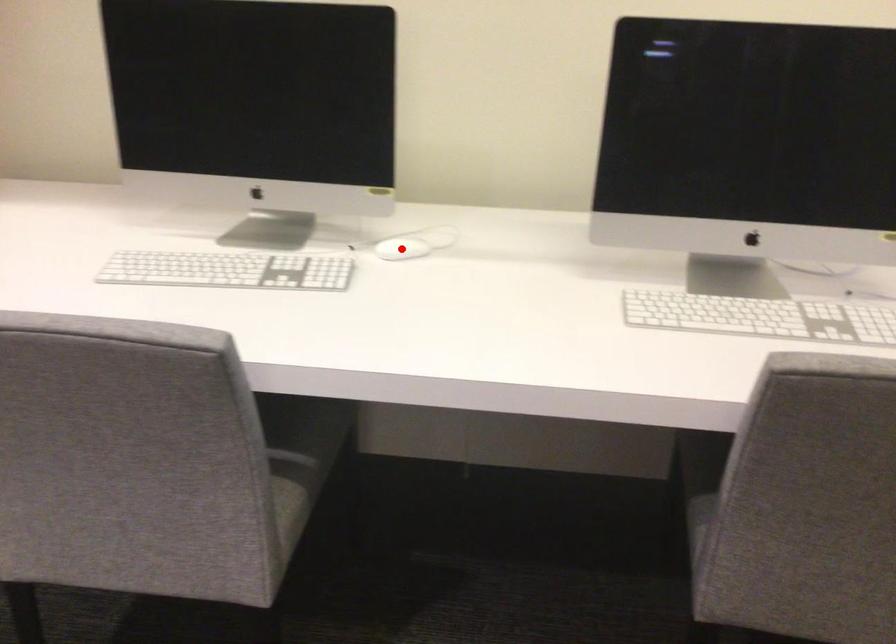
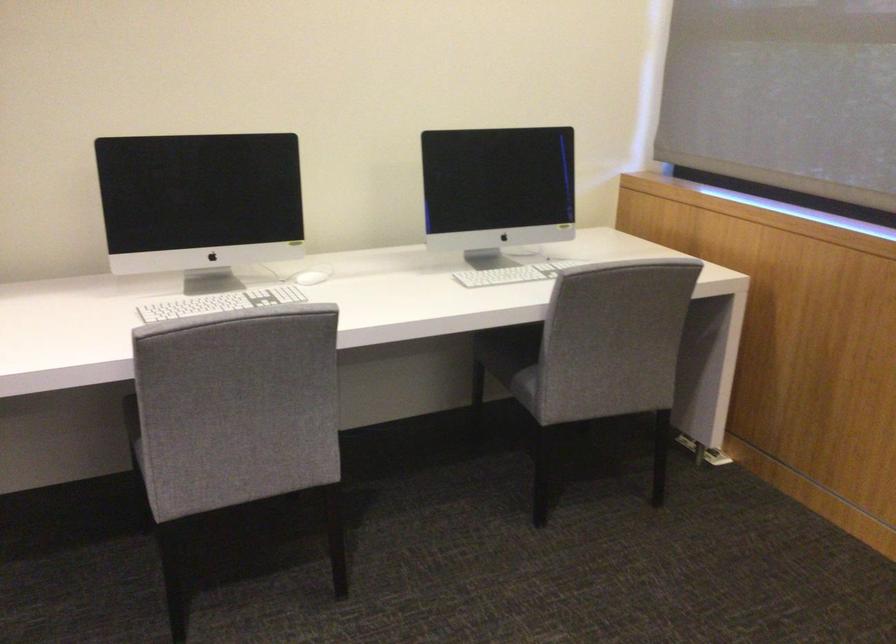
Where in the second image is the point corresponding to the highlighted location from the first image?

(307, 277)